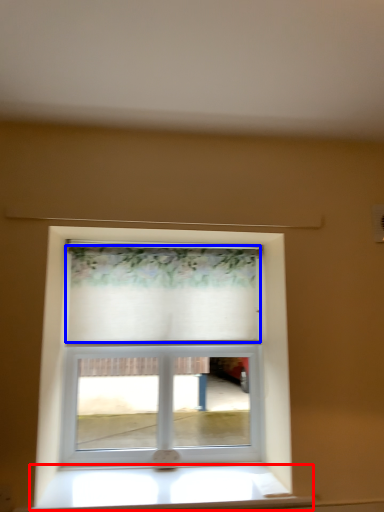
Question: Which object appears closest to the camera in this image, window sill (highlighted by a red box) or curtain (highlighted by a blue box)?

Choices:
 (A) window sill
 (B) curtain

Answer: (A)